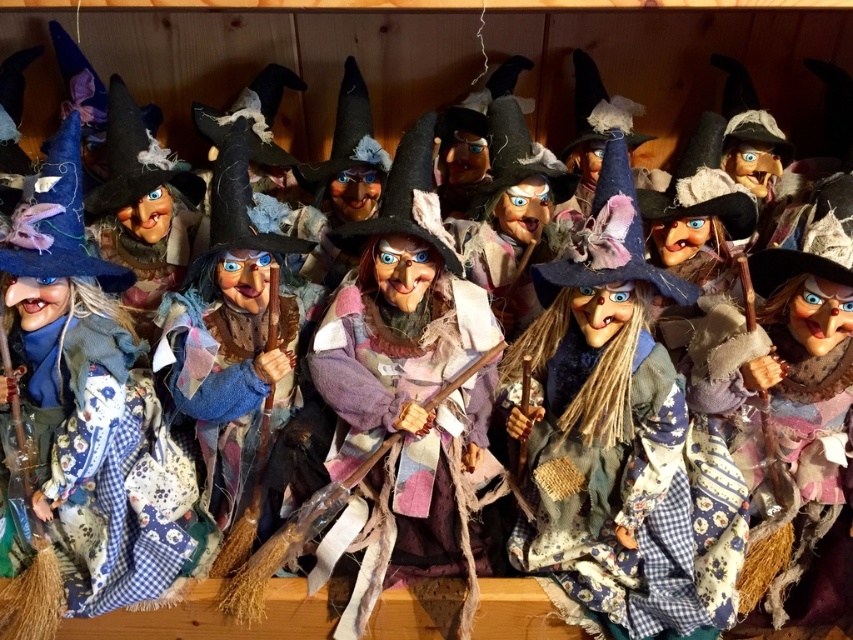
Question: Can you confirm if matte blue fabric witch at left is positioned below felt witch hat at center?

Choices:
 (A) no
 (B) yes

Answer: (B)

Question: Which of these objects is positioned closest to the matte blue fabric witch at left?

Choices:
 (A) patchwork fabric witch at center
 (B) felt witch hat at center

Answer: (B)

Question: Which of the following is the closest to the observer?

Choices:
 (A) (625, 614)
 (B) (15, 209)

Answer: (B)

Question: Is patchwork fabric witch at center to the left of matte blue fabric witch at left from the viewer's perspective?

Choices:
 (A) no
 (B) yes

Answer: (A)

Question: From the image, what is the correct spatial relationship of patchwork fabric witch at center in relation to matte blue fabric witch at left?

Choices:
 (A) below
 (B) above

Answer: (A)

Question: Which point is closer to the camera taking this photo?

Choices:
 (A) (103, 470)
 (B) (398, 218)
 (C) (581, 323)

Answer: (B)